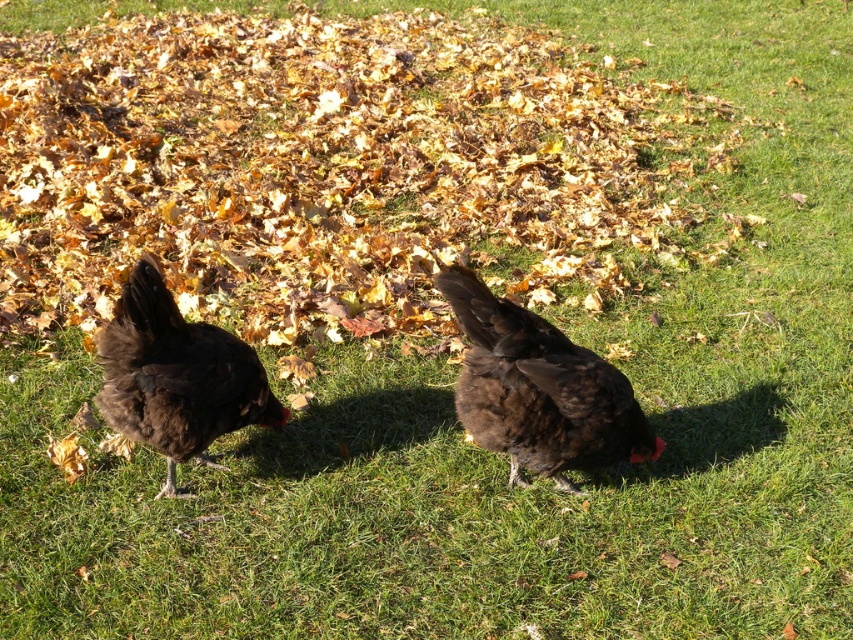
Is brown fuzzy chicken at center taller than brown fluffy chicken at left?

Incorrect, brown fuzzy chicken at center's height is not larger of brown fluffy chicken at left's.

Can you confirm if brown fuzzy chicken at center is positioned to the right of brown fluffy chicken at left?

Yes, brown fuzzy chicken at center is to the right of brown fluffy chicken at left.

Between point (602, 394) and point (227, 412), which one is positioned in front?

Point (602, 394) is in front.

At what (x,y) coordinates should I click in order to perform the action: click on brown fuzzy chicken at center. Please return your answer as a coordinate pair (x, y). The image size is (853, 640). Looking at the image, I should click on (538, 388).